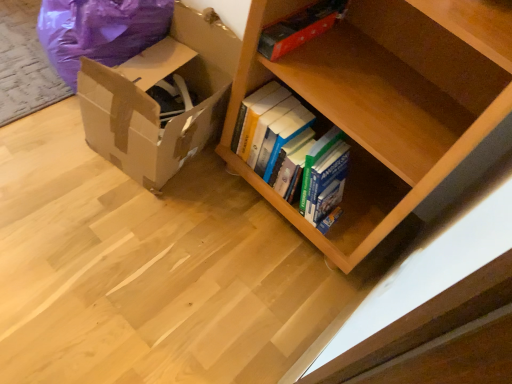
Identify the location of free space to the left of brown cardboard box at lower left. (42, 119).